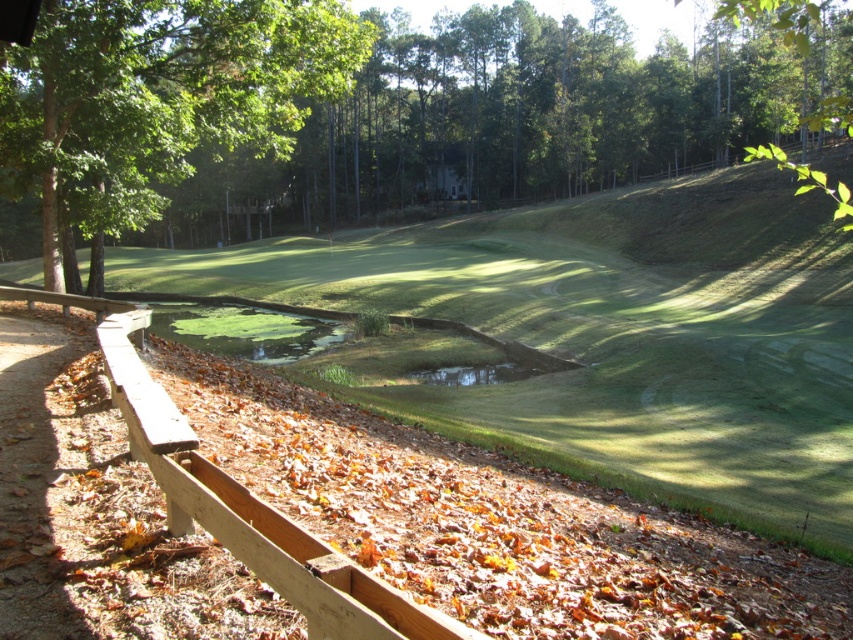
Between green leafy tree at upper center and green leafy tree at upper left, which one appears on the right side from the viewer's perspective?

green leafy tree at upper center is more to the right.

Does green leafy tree at upper center have a greater width compared to green leafy tree at upper left?

Yes.

What do you see at coordinates (525, 116) in the screenshot? I see `green leafy tree at upper center` at bounding box center [525, 116].

Locate an element on the screen. Image resolution: width=853 pixels, height=640 pixels. green leafy tree at upper center is located at coordinates (525, 116).

Is green leafy tree at upper center above green grass hole at center?

Yes.

Is point (631, 141) positioned after point (483, 380)?

Yes.

Does point (379, 144) come farther from viewer compared to point (514, 380)?

That is True.

The height and width of the screenshot is (640, 853). I want to click on green leafy tree at upper center, so click(x=525, y=116).

Is green leafy tree at upper center bigger than wooden fence at lower left?

Yes.

I want to click on green leafy tree at upper center, so click(x=525, y=116).

Is point (646, 99) behind point (186, 472)?

That is True.

Find the location of a particular element. green leafy tree at upper center is located at coordinates (525, 116).